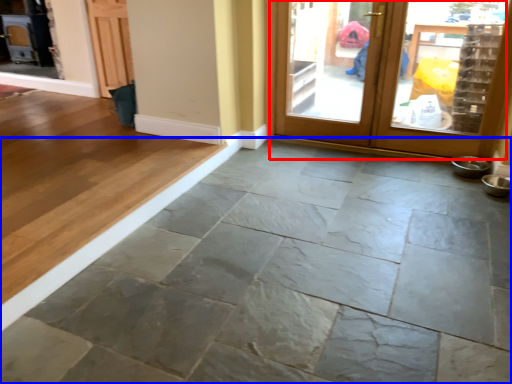
Question: Which of the following is the farthest to the observer, door (highlighted by a red box) or concrete (highlighted by a blue box)?

Choices:
 (A) door
 (B) concrete

Answer: (A)